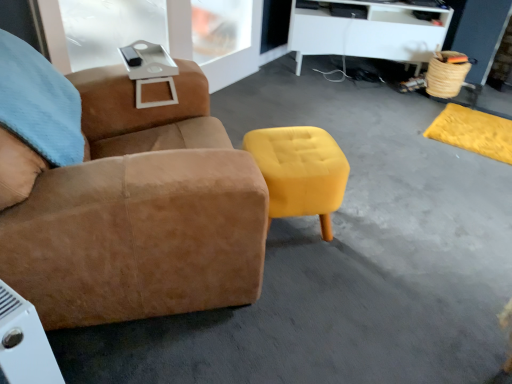
You are a GUI agent. You are given a task and a screenshot of the screen. Output one action in this format:
    pyautogui.click(x=<x>, y=<y>)
    Task: Click on the vacant space underneath white matte desk at upper center (from a real-world perspective)
    The width and height of the screenshot is (512, 384).
    Given the screenshot: What is the action you would take?
    tap(336, 73)